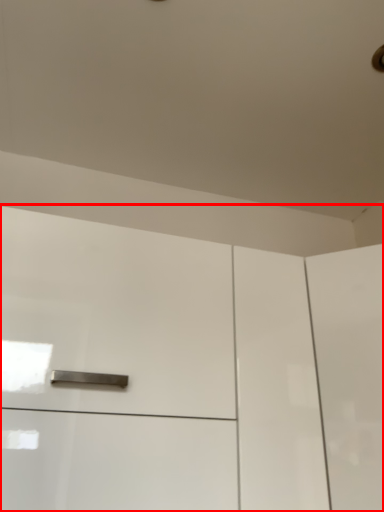
Question: From the image's perspective, what is the correct spatial relationship of cabinetry (annotated by the red box) in relation to screen door?

Choices:
 (A) below
 (B) above

Answer: (B)